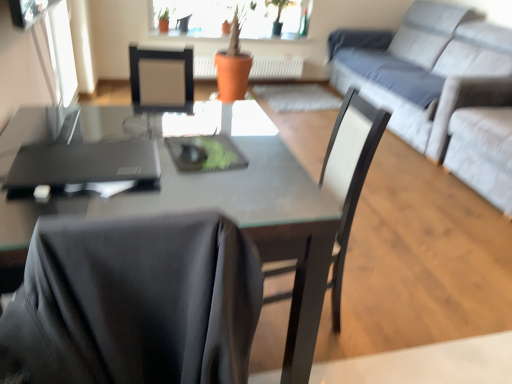
The image size is (512, 384). Find the location of `empty space that is ontop of black matte laptop at left (from a real-world perspective)`. empty space that is ontop of black matte laptop at left (from a real-world perspective) is located at coordinates (101, 153).